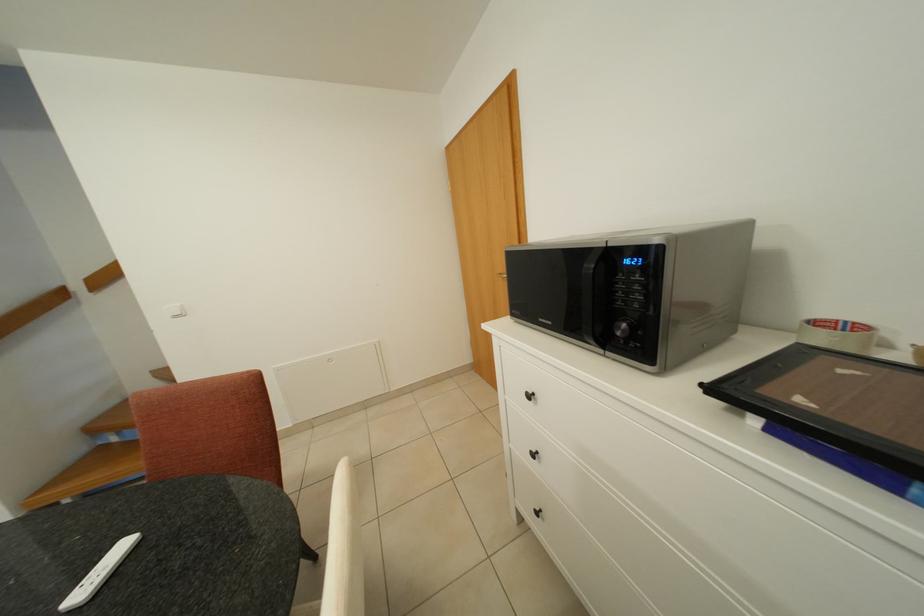
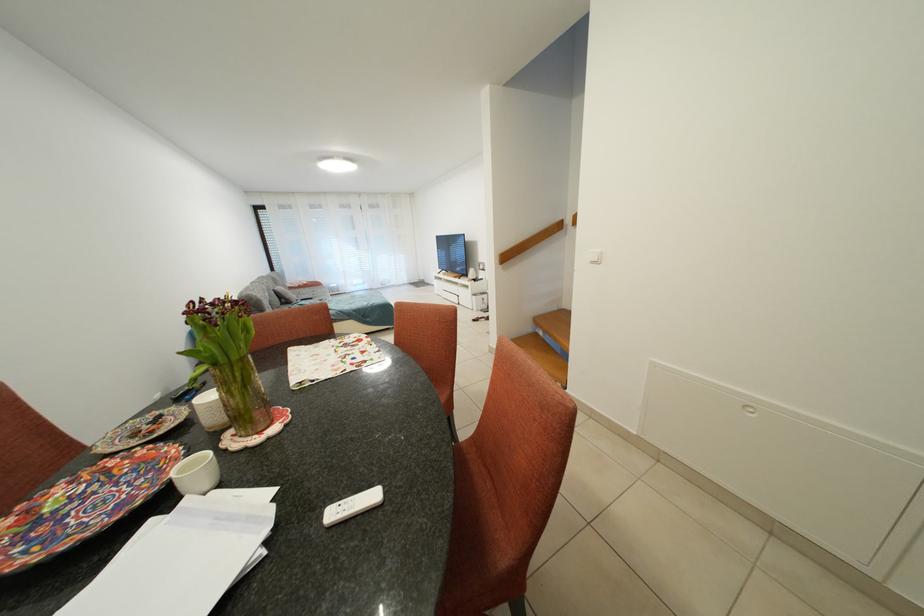
Locate, in the second image, the point that corresponds to (x=131, y=549) in the first image.

(382, 501)